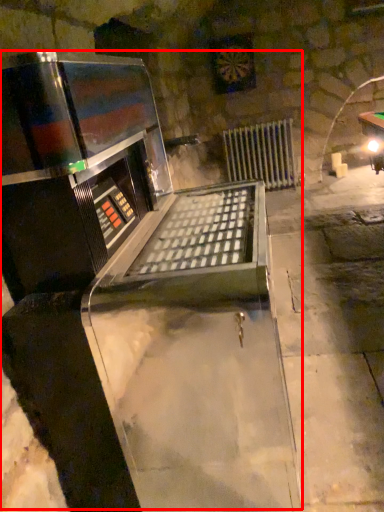
Question: Considering the relative positions of wine cellar (annotated by the red box) and radiator in the image provided, where is wine cellar (annotated by the red box) located with respect to the staircase?

Choices:
 (A) right
 (B) left

Answer: (B)